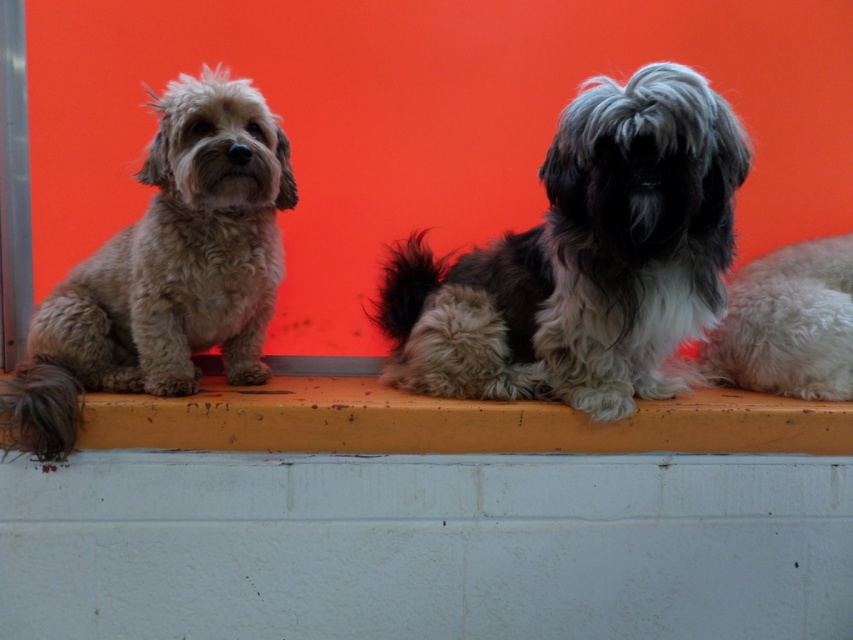
Question: Which point is farther to the camera?

Choices:
 (A) yellow painted wood at center
 (B) white fluffy dog at center

Answer: (B)

Question: Among these objects, which one is farthest from the camera?

Choices:
 (A) light brown fur at left
 (B) fluffy white dog at center
 (C) white fluffy dog at center

Answer: (C)

Question: Observing the image, what is the correct spatial positioning of light brown fur at left in reference to white fluffy dog at center?

Choices:
 (A) right
 (B) left

Answer: (B)

Question: Among these points, which one is nearest to the camera?

Choices:
 (A) (750, 337)
 (B) (599, 90)

Answer: (B)

Question: Is fluffy white dog at center further to the viewer compared to yellow painted wood at center?

Choices:
 (A) yes
 (B) no

Answer: (B)

Question: Does light brown fur at left have a smaller size compared to white fluffy dog at center?

Choices:
 (A) no
 (B) yes

Answer: (A)